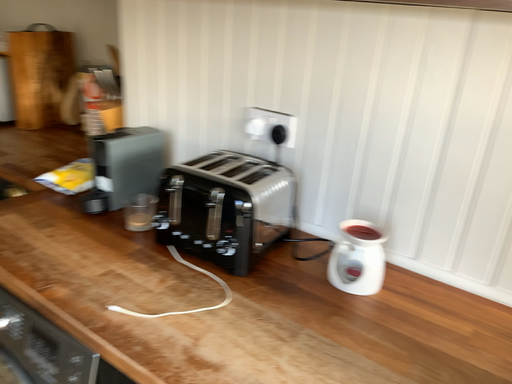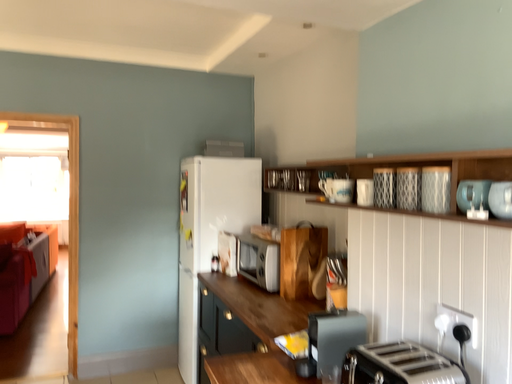
Question: How did the camera likely rotate when shooting the video?

Choices:
 (A) rotated upward
 (B) rotated downward

Answer: (A)